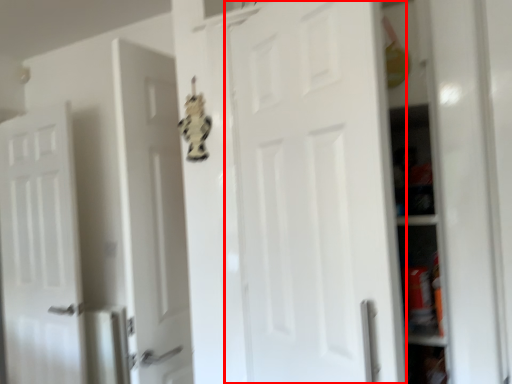
Question: From the image's perspective, where is door (annotated by the red box) located relative to door?

Choices:
 (A) below
 (B) above

Answer: (B)